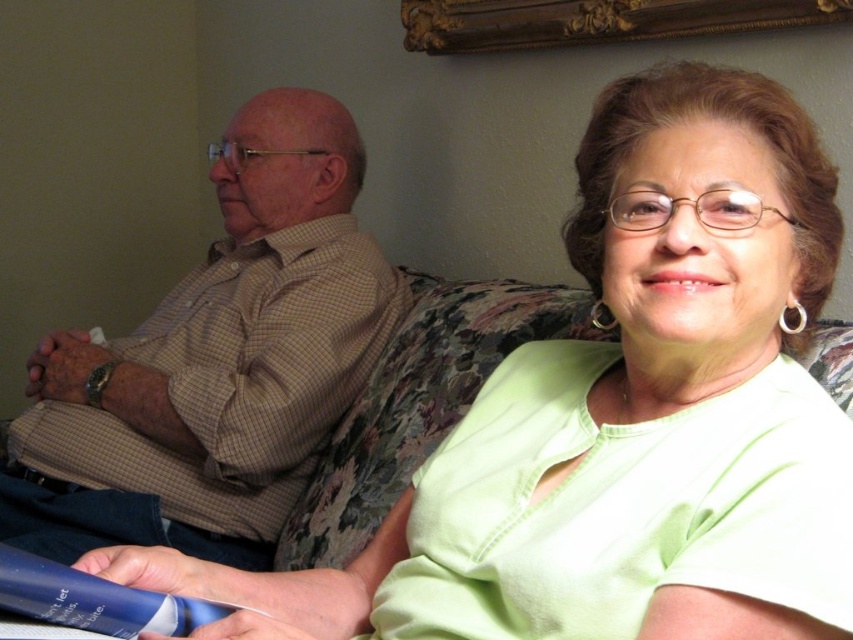
You are designing a layout for a magazine article that requires the brown checkered shirt at left and the gold ornate picture frame at upper center to be placed side by side. Given their sizes, which object should be positioned first to maintain visual balance?

The brown checkered shirt at left should be positioned first since it is wider than the gold ornate picture frame at upper center, ensuring the layout remains balanced by starting with the larger element.

You are a photographer taking a picture of the brown checkered shirt at left and the blue plastic tube at lower left. Which object should you zoom in on to ensure both fit in the frame without cropping?

You should zoom in on the blue plastic tube at lower left because the brown checkered shirt at left is wider than the blue plastic tube at lower left, so focusing on the narrower object allows both to fit in the frame.

Where is the brown checkered shirt at left located in the image?

The brown checkered shirt at left is located at the 2D coordinates point (215, 362) in the image.